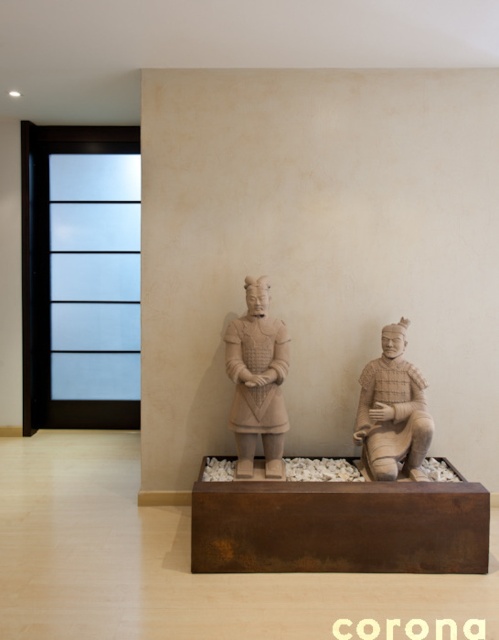
Question: Is matte clay warrior at center positioned behind earthy clay warrior at center?

Choices:
 (A) yes
 (B) no

Answer: (A)

Question: Among these objects, which one is farthest from the camera?

Choices:
 (A) earthy clay warrior at center
 (B) matte clay warrior at center

Answer: (B)

Question: Does matte clay warrior at center appear on the left side of earthy clay warrior at center?

Choices:
 (A) no
 (B) yes

Answer: (B)

Question: Is matte clay warrior at center to the right of earthy clay warrior at center from the viewer's perspective?

Choices:
 (A) yes
 (B) no

Answer: (B)